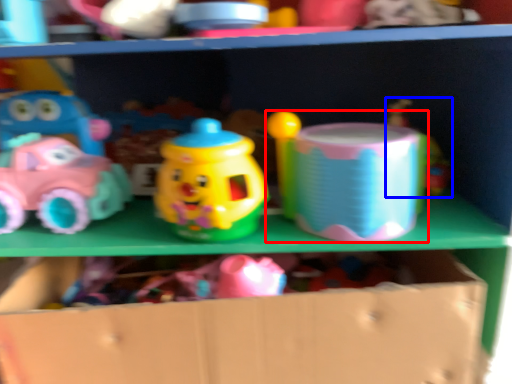
Question: Which point is closer to the camera, toy (highlighted by a red box) or toy (highlighted by a blue box)?

Choices:
 (A) toy
 (B) toy

Answer: (A)